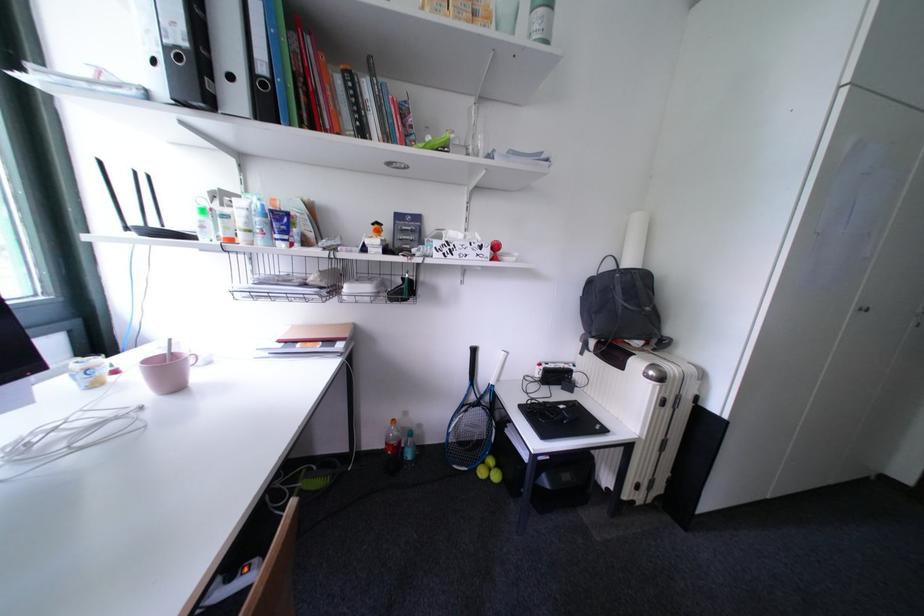
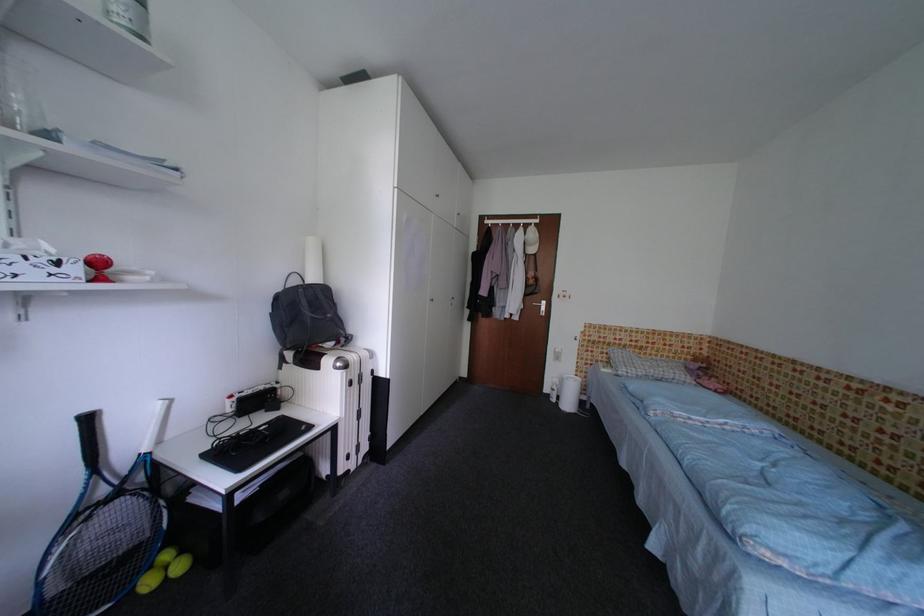
The point at (494, 254) is marked in the first image. Where is the corresponding point in the second image?

(83, 272)